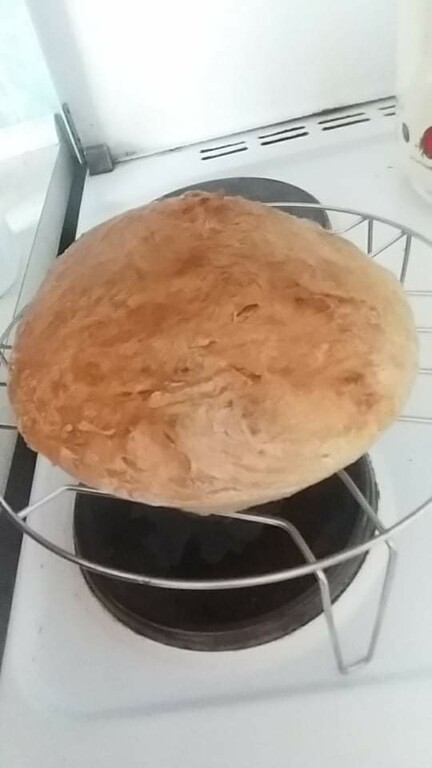
Where is `burner`? burner is located at coordinates (245, 189), (213, 608).